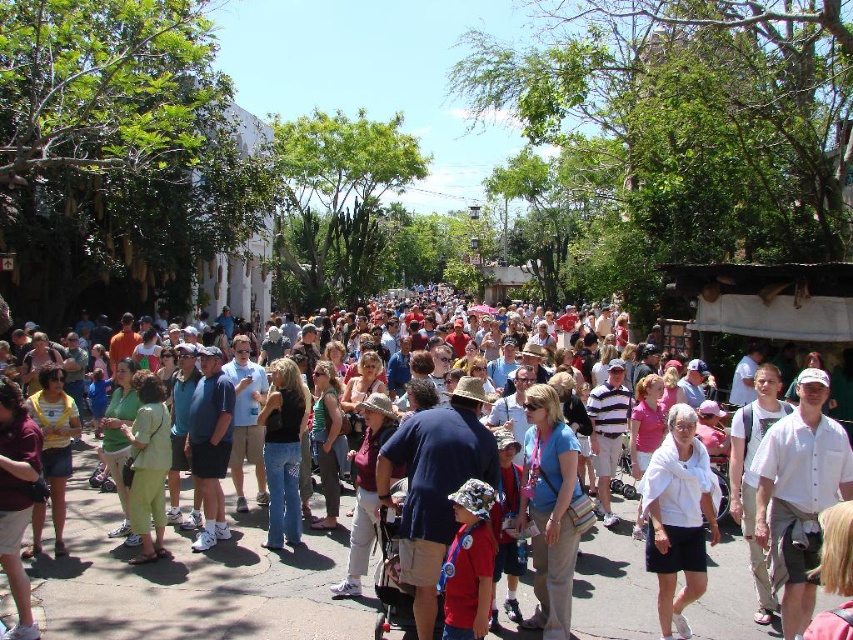
Question: Among these points, which one is farthest from the camera?

Choices:
 (A) (207, 435)
 (B) (258, 420)
 (C) (566, 496)

Answer: (B)

Question: Which of the following is the closest to the observer?

Choices:
 (A) (183, 550)
 (B) (544, 392)

Answer: (B)

Question: Is white cotton shirt at center positioned behind blue fabric shirt at center?

Choices:
 (A) yes
 (B) no

Answer: (B)

Question: Which object is the farthest from the white cotton shirt at center-right?

Choices:
 (A) black denim jeans at center
 (B) blue fabric shirt at center
 (C) green fabric dress at center
 (D) multicolored casual attire at center

Answer: (C)

Question: Is white cotton shirt at center closer to camera compared to black denim jeans at center?

Choices:
 (A) yes
 (B) no

Answer: (A)

Question: Is black denim jeans at center bigger than matte blue shirt at center?

Choices:
 (A) no
 (B) yes

Answer: (A)